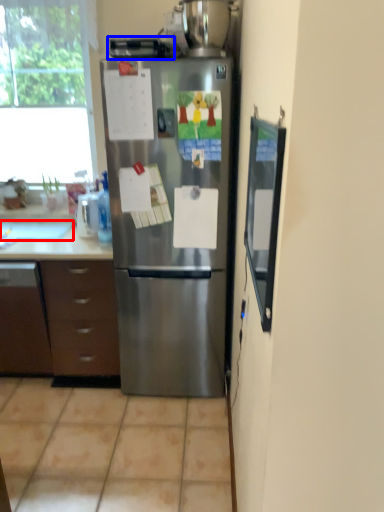
Question: Which point is further to the camera, sink (highlighted by a red box) or appliance (highlighted by a blue box)?

Choices:
 (A) sink
 (B) appliance

Answer: (A)